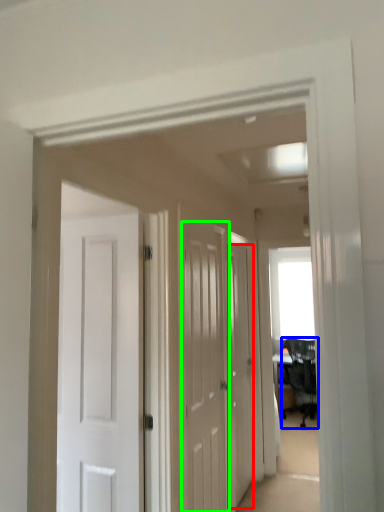
Question: Based on their relative distances, which object is farther from door (highlighted by a red box)? Choose from chair (highlighted by a blue box) and door (highlighted by a green box).

Choices:
 (A) chair
 (B) door

Answer: (A)